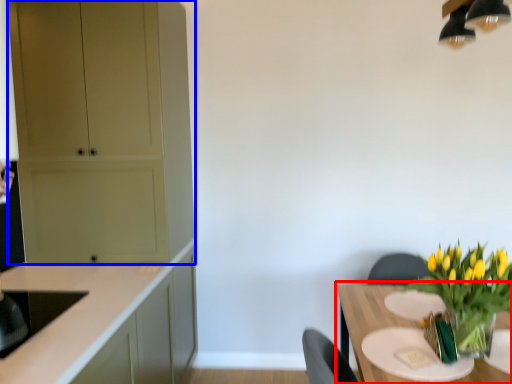
Question: Which object appears closest to the camera in this image, table (highlighted by a red box) or cabinetry (highlighted by a blue box)?

Choices:
 (A) table
 (B) cabinetry

Answer: (A)